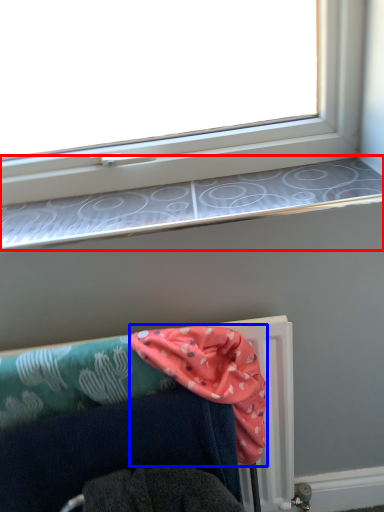
Question: Which object appears closest to the camera in this image, window sill (highlighted by a red box) or scarf (highlighted by a blue box)?

Choices:
 (A) window sill
 (B) scarf

Answer: (B)